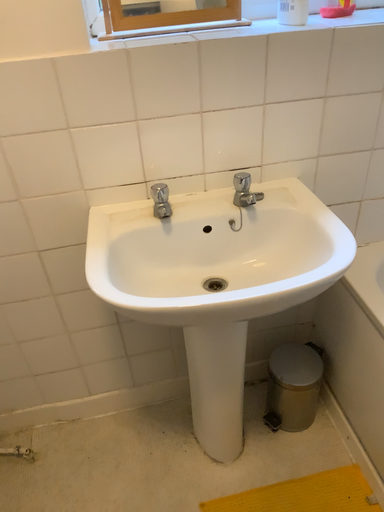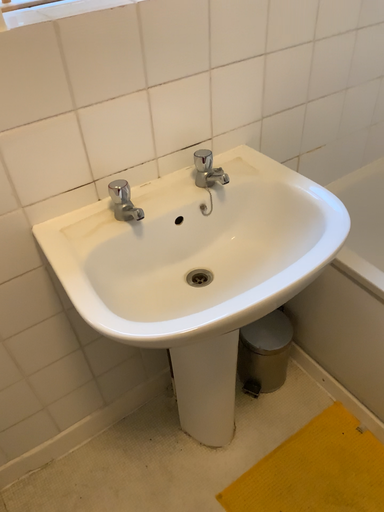
Question: How did the camera likely rotate when shooting the video?

Choices:
 (A) rotated right
 (B) rotated left

Answer: (A)